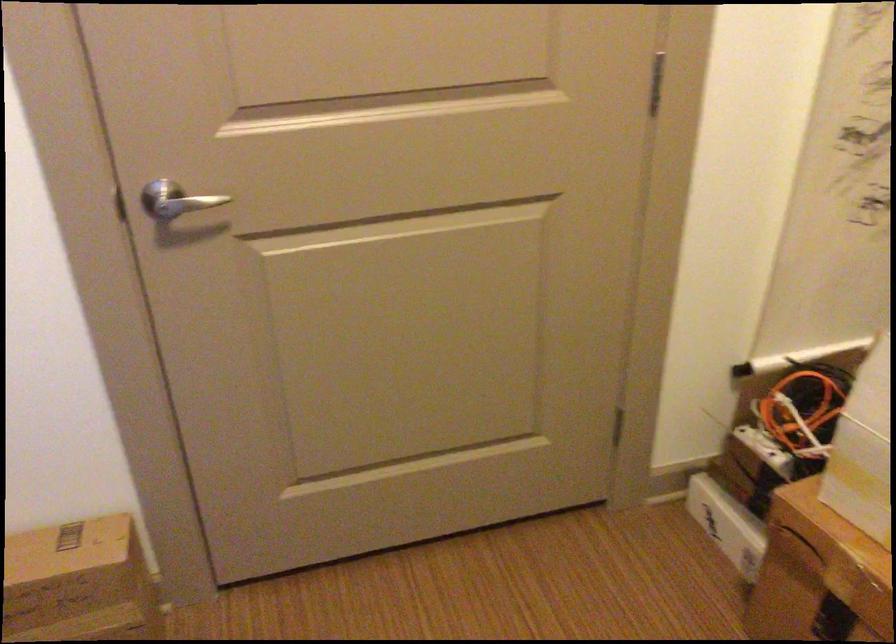
Find the location of a particular element. This screenshot has height=644, width=896. white box is located at coordinates (864, 450).